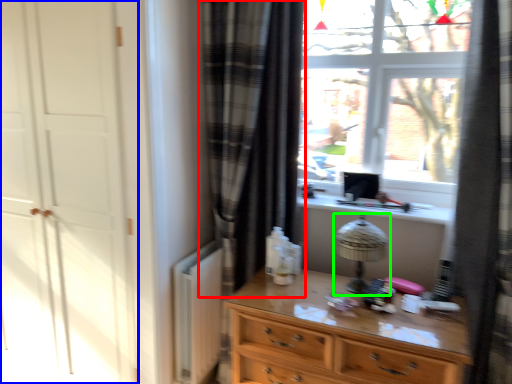
Question: Which object is positioned farthest from curtain (highlighted by a red box)? Select from screen door (highlighted by a blue box) and table lamp (highlighted by a green box).

Choices:
 (A) screen door
 (B) table lamp

Answer: (A)